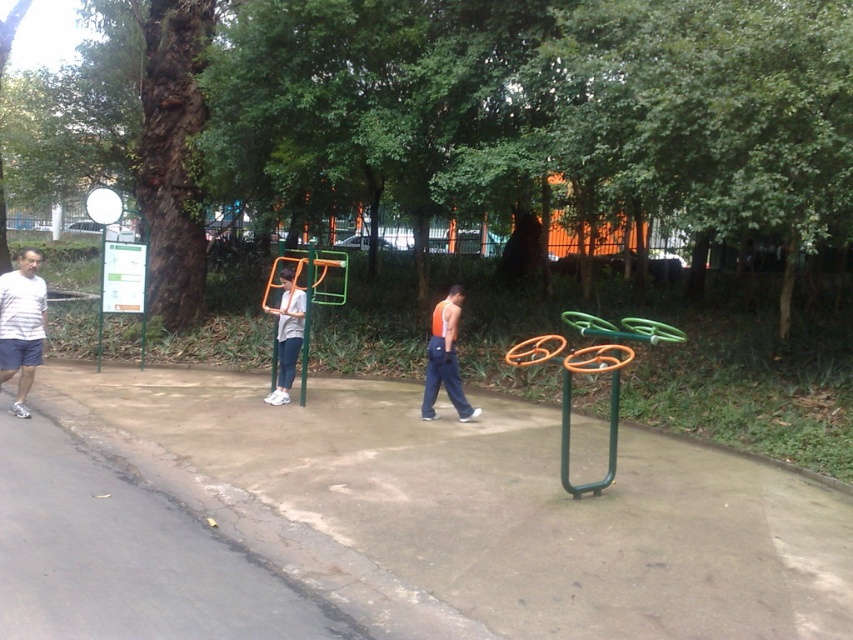
Is matte gray shirt at center thinner than white glossy basketball hoop at upper left?

Yes, matte gray shirt at center is thinner than white glossy basketball hoop at upper left.

Can you confirm if matte gray shirt at center is positioned to the left of white glossy basketball hoop at upper left?

In fact, matte gray shirt at center is to the right of white glossy basketball hoop at upper left.

Locate an element on the screen. This screenshot has height=640, width=853. matte gray shirt at center is located at coordinates (287, 336).

At what (x,y) coordinates should I click in order to perform the action: click on matte gray shirt at center. Please return your answer as a coordinate pair (x, y). The image size is (853, 640). Looking at the image, I should click on (287, 336).

Is point (277, 381) less distant than point (102, 262)?

Yes, point (277, 381) is closer to viewer.

Is point (289, 385) behind point (96, 358)?

No, (289, 385) is in front of (96, 358).

Identify the location of matte gray shirt at center. [x=287, y=336].

I want to click on matte gray shirt at center, so click(x=287, y=336).

Does white striped shirt at left have a lesser height compared to orange fabric tank top at center?

Correct, white striped shirt at left is not as tall as orange fabric tank top at center.

Between white striped shirt at left and orange fabric tank top at center, which one is positioned lower?

orange fabric tank top at center is below.

Find the location of `white striped shirt at left`. white striped shirt at left is located at coordinates (21, 324).